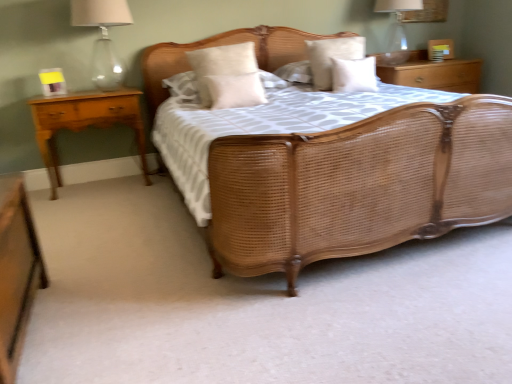
Question: Would you say white soft pillow at upper center, acting as the second pillow starting from the right, is to the left or to the right of woven wood bed at center in the picture?

Choices:
 (A) right
 (B) left

Answer: (A)

Question: Considering the positions of point (314, 76) and point (472, 223), is point (314, 76) closer or farther from the camera than point (472, 223)?

Choices:
 (A) closer
 (B) farther

Answer: (B)

Question: Estimate the real-world distances between objects in this image. Which object is farther from the woven wood bed at center?

Choices:
 (A) matte glass lampshade at upper right, the first bedside lamp when ordered from right to left
 (B) beige fabric pillow at center, which is the fourth pillow from right to left
 (C) white soft pillow at upper center, the 3th pillow in the left-to-right sequence
 (D) white soft pillow at center, which is the 1th pillow from right to left
 (E) beige fabric pillow at center, the 2th pillow from the left

Answer: (A)

Question: Which of these objects is positioned farthest from the beige fabric pillow at center, which appears as the 1th pillow when viewed from the left?

Choices:
 (A) light brown wood nightstand at left, which is the second nightstand from front to back
 (B) wooden nightstand at upper right, the first nightstand when ordered from back to front
 (C) matte glass lamp at upper left, placed as the first bedside lamp when sorted from left to right
 (D) white soft pillow at center, which is the 1th pillow from right to left
 (E) white soft pillow at upper center, the 3th pillow in the left-to-right sequence

Answer: (B)